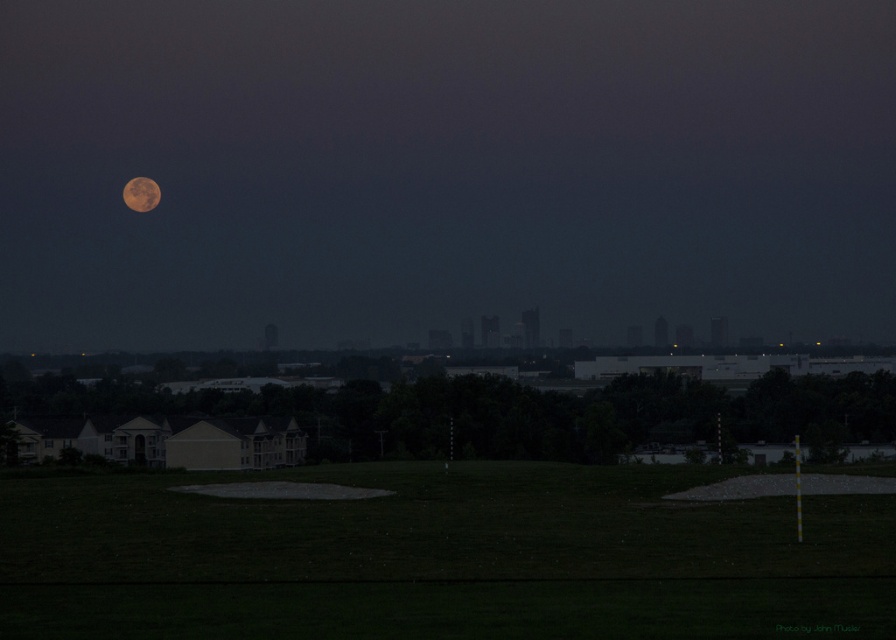
Can you confirm if green grassy field at lower center is positioned below orange textured moon at upper left?

Yes, green grassy field at lower center is below orange textured moon at upper left.

Is point (434, 573) positioned before point (138, 202)?

That is True.

Does point (487, 544) lie in front of point (132, 204)?

Yes, it is.

Where is `green grassy field at lower center`? This screenshot has height=640, width=896. green grassy field at lower center is located at coordinates (438, 557).